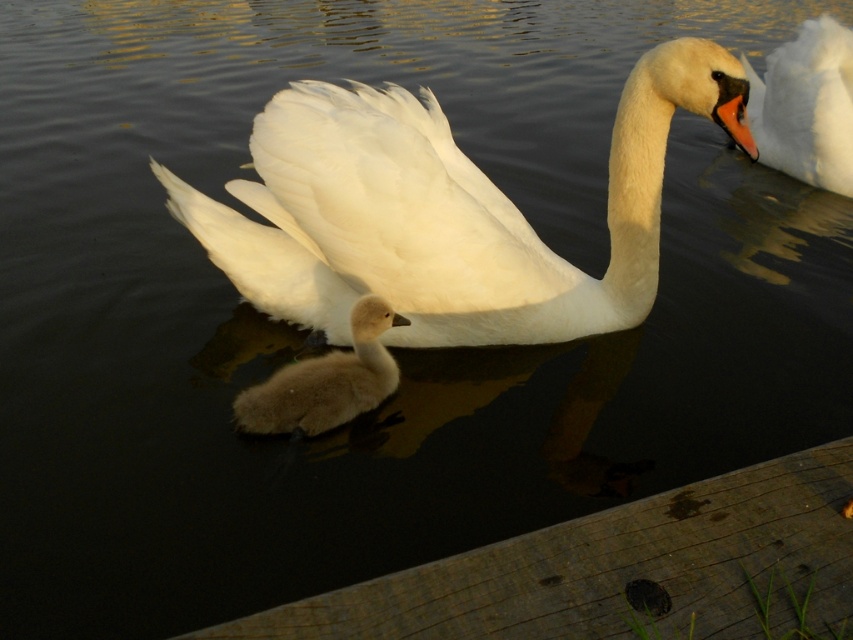
Question: Which point is farther from the camera taking this photo?

Choices:
 (A) coord(508,339)
 (B) coord(817,168)

Answer: (B)

Question: Among these objects, which one is nearest to the camera?

Choices:
 (A) soft brown downy duckling at center
 (B) white smooth swan at center
 (C) white glossy swan at upper right

Answer: (B)

Question: Among these objects, which one is nearest to the camera?

Choices:
 (A) white smooth swan at center
 (B) white glossy swan at upper right
 (C) soft brown downy duckling at center

Answer: (A)

Question: Is white smooth swan at center thinner than soft brown downy duckling at center?

Choices:
 (A) yes
 (B) no

Answer: (B)

Question: In this image, where is white smooth swan at center located relative to soft brown downy duckling at center?

Choices:
 (A) right
 (B) left

Answer: (A)

Question: Does white glossy swan at upper right appear under soft brown downy duckling at center?

Choices:
 (A) no
 (B) yes

Answer: (A)